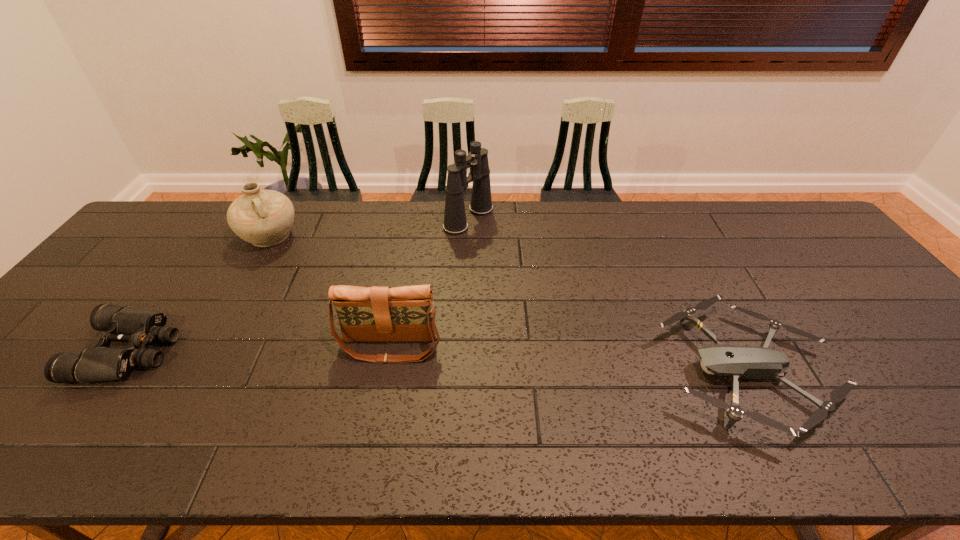
Find the location of a particular element. the taller binoculars is located at coordinates (455, 223).

Locate an element on the screen. The width and height of the screenshot is (960, 540). the farther binoculars is located at coordinates (455, 223).

Identify the location of pottery. (264, 218).

Locate an element on the screen. This screenshot has height=540, width=960. shoulder bag is located at coordinates (366, 314).

Where is `the shorter binoculars`? the shorter binoculars is located at coordinates (138, 327).

Where is `the left binoculars`? The image size is (960, 540). the left binoculars is located at coordinates (138, 327).

Where is `the rightmost object`? The width and height of the screenshot is (960, 540). the rightmost object is located at coordinates (740, 362).

I want to click on the shortest object, so click(740, 362).

Where is `free space located 0.360m on the right of the right binoculars`? free space located 0.360m on the right of the right binoculars is located at coordinates (600, 219).

Where is `vacant space located on the front of the pottery`? The height and width of the screenshot is (540, 960). vacant space located on the front of the pottery is located at coordinates (209, 343).